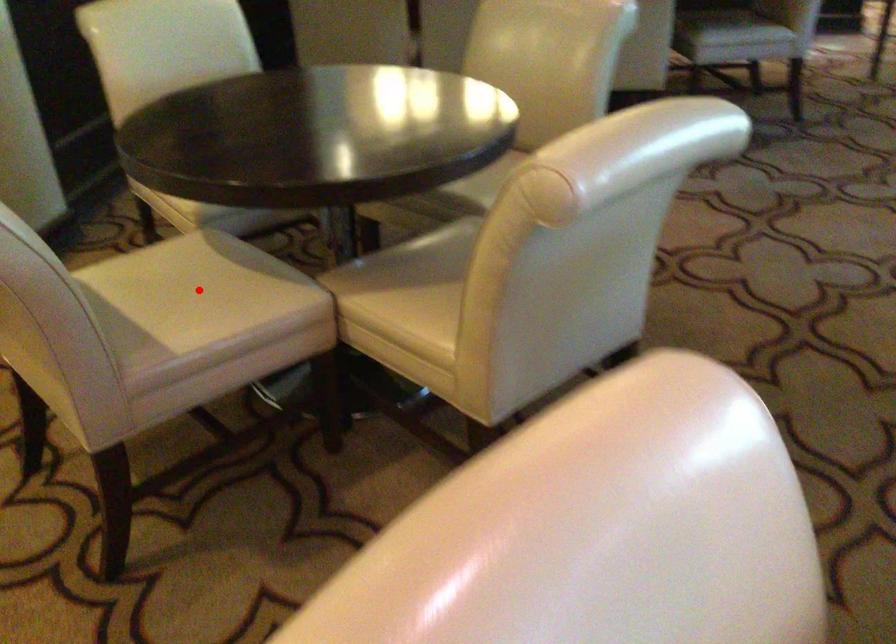
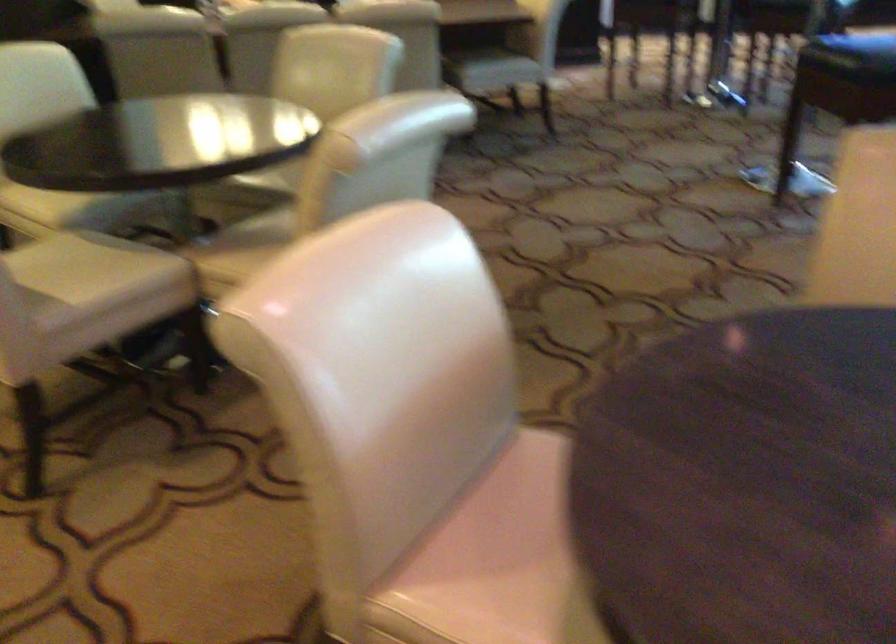
Where in the second image is the point corresponding to the highlighted location from the first image?

(82, 266)